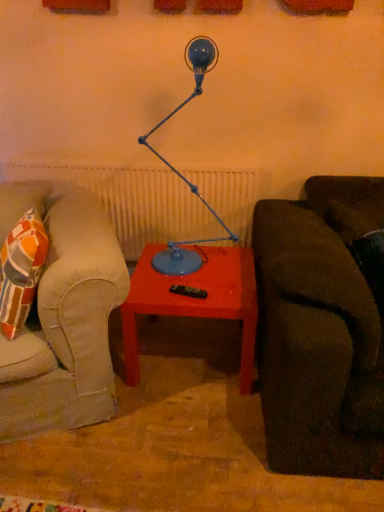
Question: Looking at their shapes, would you say blue matte table lamp at center is wider or thinner than matte red table at center?

Choices:
 (A) thin
 (B) wide

Answer: (A)

Question: From a real-world perspective, relative to matte red table at center, is blue matte table lamp at center vertically above or below?

Choices:
 (A) above
 (B) below

Answer: (A)

Question: Considering the positions of point (175, 274) and point (215, 273), is point (175, 274) closer or farther from the camera than point (215, 273)?

Choices:
 (A) farther
 (B) closer

Answer: (B)

Question: In the image, is matte red table at center positioned in front of or behind blue matte table lamp at center?

Choices:
 (A) behind
 (B) front

Answer: (A)

Question: Looking at their shapes, would you say matte red table at center is wider or thinner than blue matte table lamp at center?

Choices:
 (A) thin
 (B) wide

Answer: (B)

Question: Is point (243, 365) positioned closer to the camera than point (188, 48)?

Choices:
 (A) closer
 (B) farther

Answer: (B)

Question: From the image's perspective, is matte red table at center above or below blue matte table lamp at center?

Choices:
 (A) above
 (B) below

Answer: (B)